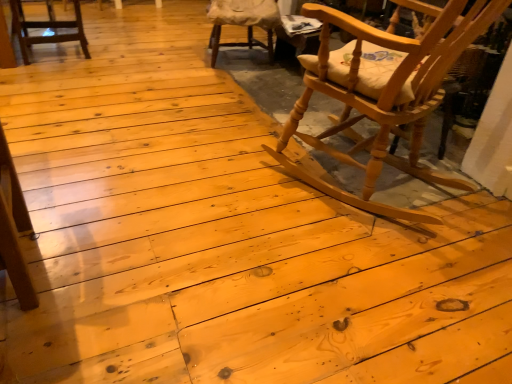
Question: Which direction should I rotate to look at wooden cushioned chair at upper center, arranged as the third chair when viewed from the front?

Choices:
 (A) left
 (B) right

Answer: (A)

Question: From a real-world perspective, is wooden cushioned chair at upper center, positioned as the second chair in right-to-left order, below matte wood chair at upper left, the 2th chair in the front-to-back sequence?

Choices:
 (A) no
 (B) yes

Answer: (A)

Question: From the image's perspective, would you say wooden cushioned chair at upper center, the 2th chair from the left, is shown under matte wood chair at upper left, marked as the 1th chair in a left-to-right arrangement?

Choices:
 (A) yes
 (B) no

Answer: (B)

Question: Would you consider wooden cushioned chair at upper center, placed as the first chair when sorted from back to front, to be distant from matte wood chair at upper left, marked as the 1th chair in a left-to-right arrangement?

Choices:
 (A) yes
 (B) no

Answer: (A)

Question: Is wooden cushioned chair at upper center, positioned as the second chair in right-to-left order, taller than matte wood chair at upper left, which is the 2th chair in back-to-front order?

Choices:
 (A) no
 (B) yes

Answer: (B)

Question: Is wooden cushioned chair at upper center, positioned as the second chair in right-to-left order, positioned with its back to matte wood chair at upper left, which is the 2th chair in back-to-front order?

Choices:
 (A) yes
 (B) no

Answer: (B)

Question: Is wooden cushioned chair at upper center, arranged as the third chair when viewed from the front, directly adjacent to matte wood chair at upper left, marked as the 1th chair in a left-to-right arrangement?

Choices:
 (A) yes
 (B) no

Answer: (B)

Question: Can you confirm if matte wood chair at upper left, marked as the 1th chair in a left-to-right arrangement, is positioned to the right of natural wood rocking chair at right, arranged as the 1th chair when viewed from the front?

Choices:
 (A) yes
 (B) no

Answer: (B)

Question: Is matte wood chair at upper left, the 2th chair in the front-to-back sequence, beside natural wood rocking chair at right, acting as the 1th chair starting from the right?

Choices:
 (A) no
 (B) yes

Answer: (A)

Question: Considering the relative positions of matte wood chair at upper left, the 2th chair in the front-to-back sequence, and natural wood rocking chair at right, which is the third chair from left to right, in the image provided, is matte wood chair at upper left, the 2th chair in the front-to-back sequence, to the left of natural wood rocking chair at right, which is the third chair from left to right, from the viewer's perspective?

Choices:
 (A) no
 (B) yes

Answer: (B)

Question: Is the position of matte wood chair at upper left, the 2th chair in the front-to-back sequence, more distant than that of natural wood rocking chair at right, which is the 3th chair from back to front?

Choices:
 (A) no
 (B) yes

Answer: (B)

Question: Is matte wood chair at upper left, which is the 3th chair in right-to-left order, bigger than natural wood rocking chair at right, acting as the 1th chair starting from the right?

Choices:
 (A) yes
 (B) no

Answer: (B)

Question: From a real-world perspective, is matte wood chair at upper left, which is the 3th chair in right-to-left order, located beneath natural wood rocking chair at right, acting as the 1th chair starting from the right?

Choices:
 (A) yes
 (B) no

Answer: (A)

Question: Considering the relative sizes of natural wood rocking chair at right, arranged as the 1th chair when viewed from the front, and matte wood chair at upper left, marked as the 1th chair in a left-to-right arrangement, in the image provided, is natural wood rocking chair at right, arranged as the 1th chair when viewed from the front, bigger than matte wood chair at upper left, marked as the 1th chair in a left-to-right arrangement,?

Choices:
 (A) yes
 (B) no

Answer: (A)